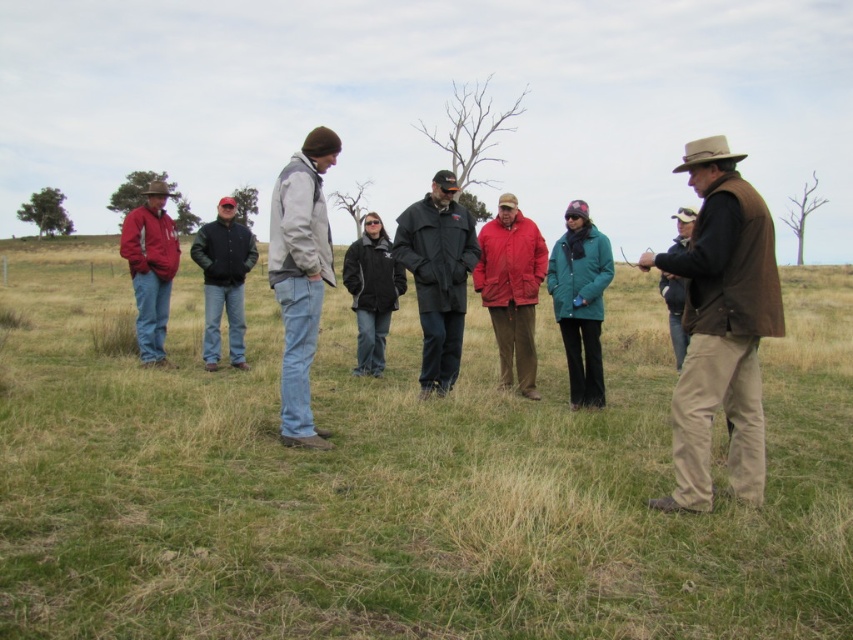
You are part of the group standing in the grassy field. The leader is pointing to an object located between the light gray jacket at center and the teal fabric jacket at center. Which jacket is closer to the object the leader is pointing at?

The light gray jacket at center is to the left of teal fabric jacket at center. Since the object is between them, the light gray jacket at center is closer to the object the leader is pointing at.

You are standing in the field and see two points marked in the image. Which point is closer to you, point (x=518, y=291) or point (x=148, y=364)?

Point (x=518, y=291) is closer to the viewer than point (x=148, y=364).